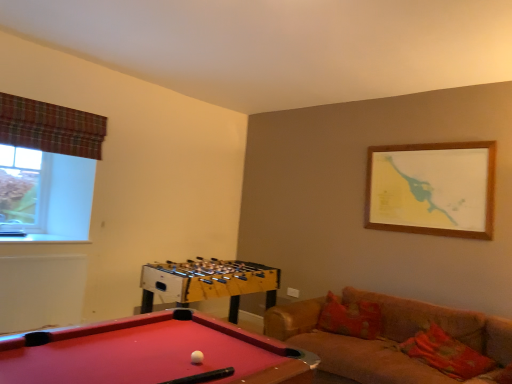
Question: Is white matte ball at center shorter than floral fabric pillow at lower right?

Choices:
 (A) no
 (B) yes

Answer: (B)

Question: From the image's perspective, is white matte ball at center on floral fabric pillow at lower right?

Choices:
 (A) yes
 (B) no

Answer: (A)

Question: Is white matte ball at center outside floral fabric pillow at lower right?

Choices:
 (A) yes
 (B) no

Answer: (A)

Question: From the image's perspective, is white matte ball at center under floral fabric pillow at lower right?

Choices:
 (A) yes
 (B) no

Answer: (B)

Question: Can you confirm if white matte ball at center is smaller than floral fabric pillow at lower right?

Choices:
 (A) yes
 (B) no

Answer: (A)

Question: From a real-world perspective, is white matte ball at center under floral fabric pillow at lower right?

Choices:
 (A) yes
 (B) no

Answer: (B)

Question: Is clear glass window at upper left not near velvet brown couch at lower right?

Choices:
 (A) no
 (B) yes

Answer: (B)

Question: Can you confirm if clear glass window at upper left is thinner than velvet brown couch at lower right?

Choices:
 (A) yes
 (B) no

Answer: (A)

Question: Is clear glass window at upper left outside velvet brown couch at lower right?

Choices:
 (A) yes
 (B) no

Answer: (A)

Question: Does clear glass window at upper left touch velvet brown couch at lower right?

Choices:
 (A) yes
 (B) no

Answer: (B)

Question: Is clear glass window at upper left bigger than velvet brown couch at lower right?

Choices:
 (A) yes
 (B) no

Answer: (B)

Question: From the image's perspective, would you say clear glass window at upper left is positioned over velvet brown couch at lower right?

Choices:
 (A) no
 (B) yes

Answer: (B)

Question: From the image's perspective, would you say clear glass window at upper left is shown under plaid fabric curtain at upper left?

Choices:
 (A) yes
 (B) no

Answer: (A)